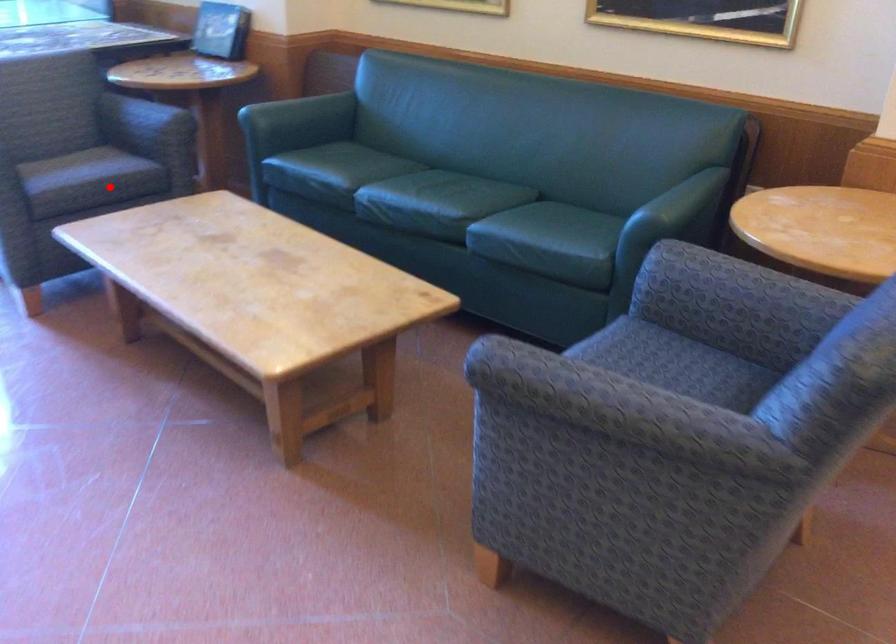
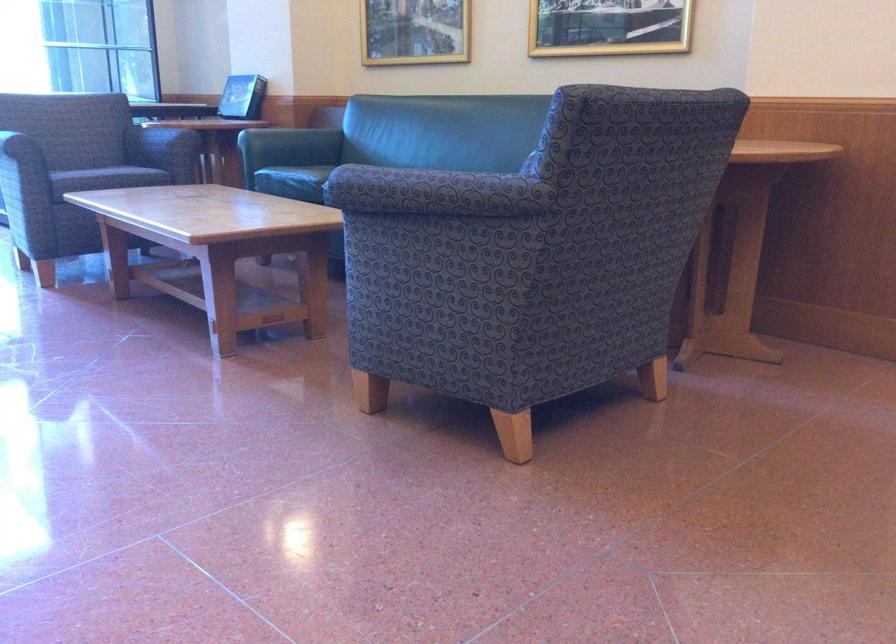
Question: I am providing you with two images of the same scene from different viewpoints. In image1, a red point is highlighted. Considering the same 3D point in image2, which of the following is correct?

Choices:
 (A) It is closer
 (B) It is farther

Answer: (B)